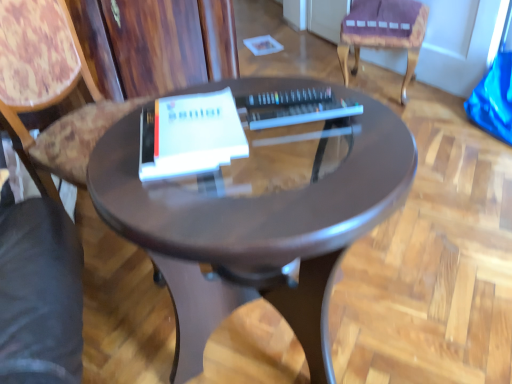
Question: Can you confirm if white matte paperback book at center is smaller than glossy brown table at center?

Choices:
 (A) yes
 (B) no

Answer: (A)

Question: Is white matte paperback book at center next to glossy brown table at center?

Choices:
 (A) no
 (B) yes

Answer: (A)

Question: Considering the relative positions of white matte paperback book at center and glossy brown table at center in the image provided, is white matte paperback book at center in front of glossy brown table at center?

Choices:
 (A) yes
 (B) no

Answer: (B)

Question: Is glossy brown table at center located within white matte paperback book at center?

Choices:
 (A) no
 (B) yes

Answer: (A)

Question: From the image's perspective, is white matte paperback book at center on glossy brown table at center?

Choices:
 (A) no
 (B) yes

Answer: (B)

Question: Based on their sizes in the image, would you say wooden at left, the 2th chair when ordered from back to front, is bigger or smaller than white matte paperback book at center?

Choices:
 (A) big
 (B) small

Answer: (A)

Question: Is point (42, 178) closer or farther from the camera than point (169, 127)?

Choices:
 (A) closer
 (B) farther

Answer: (B)

Question: From a real-world perspective, is wooden at left, which is the first chair from left to right, physically located above or below white matte paperback book at center?

Choices:
 (A) below
 (B) above

Answer: (A)

Question: Is wooden at left, which is the first chair from left to right, spatially inside white matte paperback book at center, or outside of it?

Choices:
 (A) outside
 (B) inside

Answer: (A)

Question: From the image's perspective, is white matte paperback book at center located above or below wooden at left, which ranks as the 2th chair in right-to-left order?

Choices:
 (A) above
 (B) below

Answer: (B)

Question: Is white matte paperback book at center to the left or to the right of wooden at left, the 2th chair when ordered from back to front, in the image?

Choices:
 (A) right
 (B) left

Answer: (A)

Question: Based on their sizes in the image, would you say white matte paperback book at center is bigger or smaller than wooden at left, the 2th chair when ordered from back to front?

Choices:
 (A) big
 (B) small

Answer: (B)

Question: Which is correct: white matte paperback book at center is inside wooden at left, which ranks as the 2th chair in right-to-left order, or outside of it?

Choices:
 (A) outside
 (B) inside

Answer: (A)

Question: Considering their positions, is wooden at left, which ranks as the 2th chair in right-to-left order, located in front of or behind purple fabric cushion at upper right, arranged as the 1th chair when viewed from the back?

Choices:
 (A) front
 (B) behind

Answer: (A)

Question: In terms of width, does wooden at left, which is the first chair from left to right, look wider or thinner when compared to purple fabric cushion at upper right, arranged as the 1th chair when viewed from the back?

Choices:
 (A) wide
 (B) thin

Answer: (A)